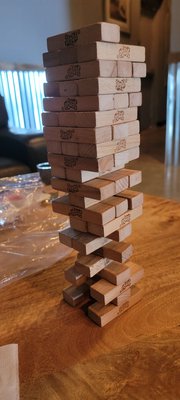
At what (x,y) coordinates should I click in order to perform the action: click on wooden table. Please return your answer as a coordinate pair (x, y). Looking at the image, I should click on (153, 366), (120, 375), (60, 333), (43, 317).